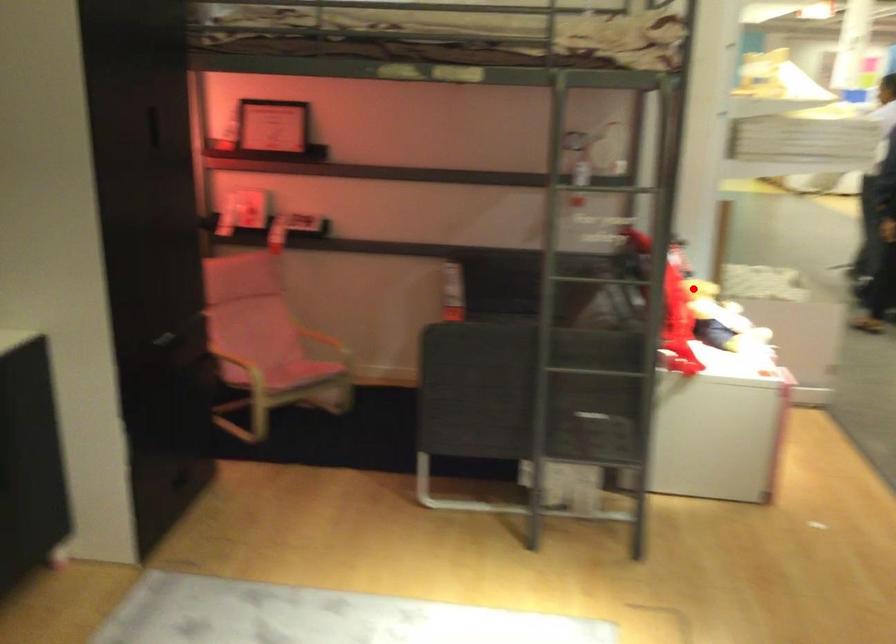
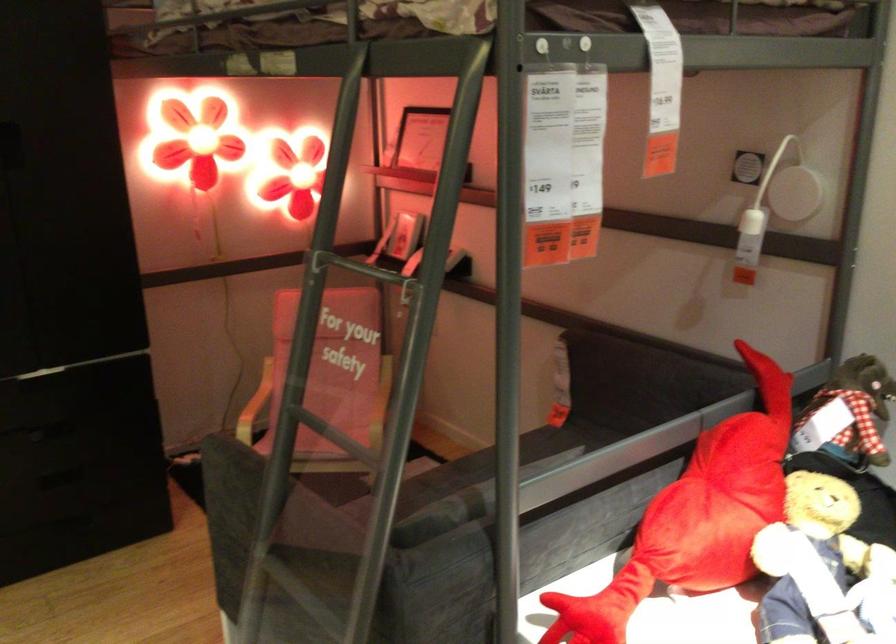
Find the pixel in the second image that matches the highlighted location in the first image.

(719, 502)